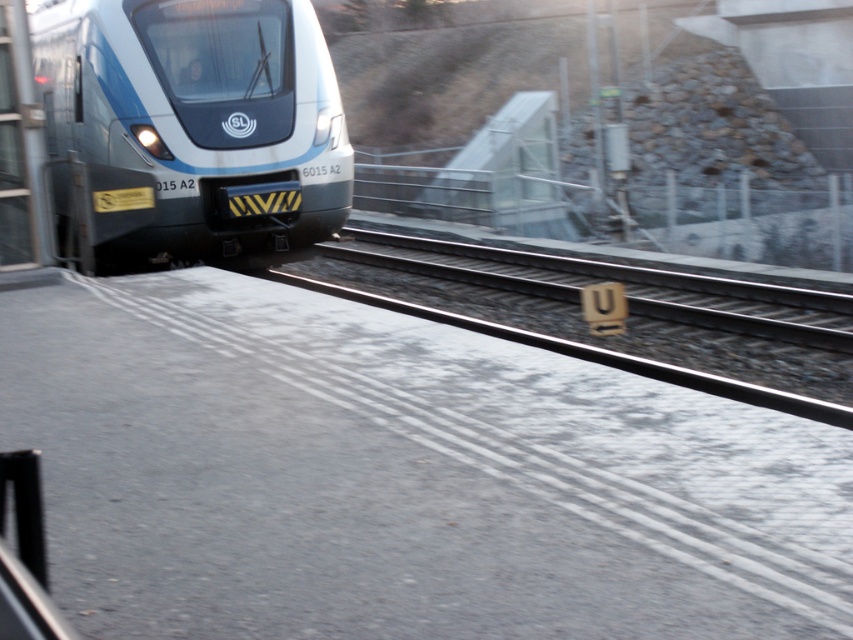
Does metallic silver train at left come behind smooth concrete train track at center?

That is True.

Who is more distant from viewer, (323, 81) or (703, 300)?

The point (323, 81) is behind.

Between point (113, 134) and point (793, 337), which one is positioned behind?

Positioned behind is point (113, 134).

Image resolution: width=853 pixels, height=640 pixels. What are the coordinates of `metallic silver train at left` in the screenshot? It's located at (196, 122).